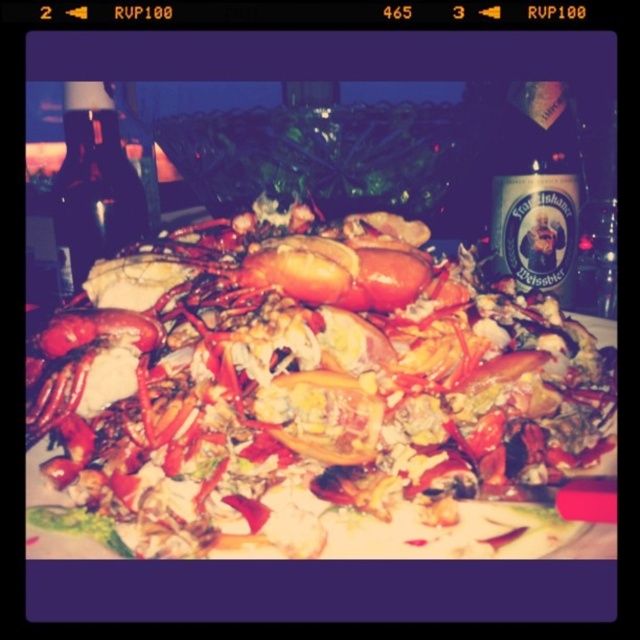
The width and height of the screenshot is (640, 640). Describe the element at coordinates (308, 401) in the screenshot. I see `shiny red lobster at center` at that location.

Can you confirm if shiny red lobster at center is bigger than translucent glass bottle at upper right?

Correct, shiny red lobster at center is larger in size than translucent glass bottle at upper right.

Between point (356, 524) and point (557, 237), which one is positioned behind?

Positioned behind is point (557, 237).

Find the location of a particular element. This screenshot has height=640, width=640. shiny red lobster at center is located at coordinates (308, 401).

Who is more forward, (387, 323) or (84, 177)?

Point (387, 323)

Who is more distant from viewer, [262,520] or [84,108]?

Point [84,108]

Identify the location of shiny red lobster at center. This screenshot has width=640, height=640. (308, 401).

The width and height of the screenshot is (640, 640). Identify the location of shiny red lobster at center. (308, 401).

Is point (538, 225) more distant than point (99, 172)?

That is False.

Does translucent glass bottle at upper right lie in front of dark glass bottle at upper left?

That is True.

Is point (499, 205) more distant than point (72, 284)?

No, (499, 205) is closer to viewer.

You are a GUI agent. You are given a task and a screenshot of the screen. Output one action in this format:
    pyautogui.click(x=<x>, y=<y>)
    Task: Click on the translucent glass bottle at upper right
    The height and width of the screenshot is (640, 640).
    Given the screenshot: What is the action you would take?
    pyautogui.click(x=536, y=188)